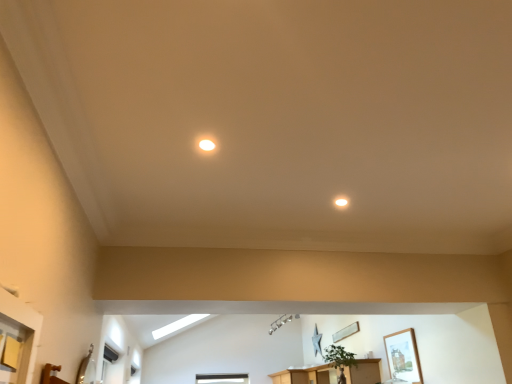
Question: Which direction should I rotate to look at matte white light fixture at upper center, acting as the second lighting starting from the left?

Choices:
 (A) right
 (B) left

Answer: (A)

Question: From the image's perspective, is green matte plant at center over wooden picture frame at center, arranged as the 1th picture frame when viewed from the back?

Choices:
 (A) yes
 (B) no

Answer: (A)

Question: Is green matte plant at center behind wooden picture frame at center, which is counted as the 2th picture frame, starting from the front?

Choices:
 (A) yes
 (B) no

Answer: (B)

Question: Is green matte plant at center turned away from wooden picture frame at center, which is the 2th picture frame from right to left?

Choices:
 (A) no
 (B) yes

Answer: (A)

Question: Does green matte plant at center have a greater width compared to wooden picture frame at center, which is counted as the 2th picture frame, starting from the front?

Choices:
 (A) yes
 (B) no

Answer: (A)

Question: From a real-world perspective, is green matte plant at center physically below wooden picture frame at center, arranged as the 1th picture frame when viewed from the back?

Choices:
 (A) no
 (B) yes

Answer: (B)

Question: Could you tell me if green matte plant at center is turned towards wooden picture frame at center, arranged as the 1th picture frame when viewed from the back?

Choices:
 (A) no
 (B) yes

Answer: (A)

Question: From the image's perspective, is green matte plant at center above matte white light fixture at upper center, positioned as the first lighting in back-to-front order?

Choices:
 (A) no
 (B) yes

Answer: (A)

Question: Does green matte plant at center contain matte white light fixture at upper center, arranged as the 2th lighting when viewed from the front?

Choices:
 (A) yes
 (B) no

Answer: (B)

Question: From the image's perspective, does green matte plant at center appear lower than matte white light fixture at upper center, arranged as the 2th lighting when viewed from the front?

Choices:
 (A) no
 (B) yes

Answer: (B)

Question: Is green matte plant at center aimed at matte white light fixture at upper center, which is the second lighting in top-to-bottom order?

Choices:
 (A) no
 (B) yes

Answer: (A)

Question: Does green matte plant at center have a greater width compared to matte white light fixture at upper center, positioned as the first lighting in back-to-front order?

Choices:
 (A) no
 (B) yes

Answer: (B)

Question: Is green matte plant at center touching matte white light fixture at upper center, which is the second lighting in top-to-bottom order?

Choices:
 (A) yes
 (B) no

Answer: (B)

Question: Considering the relative positions of wooden picture frame at center, which is counted as the 2th picture frame, starting from the front, and green matte plant at center in the image provided, is wooden picture frame at center, which is counted as the 2th picture frame, starting from the front, to the left of green matte plant at center from the viewer's perspective?

Choices:
 (A) yes
 (B) no

Answer: (B)